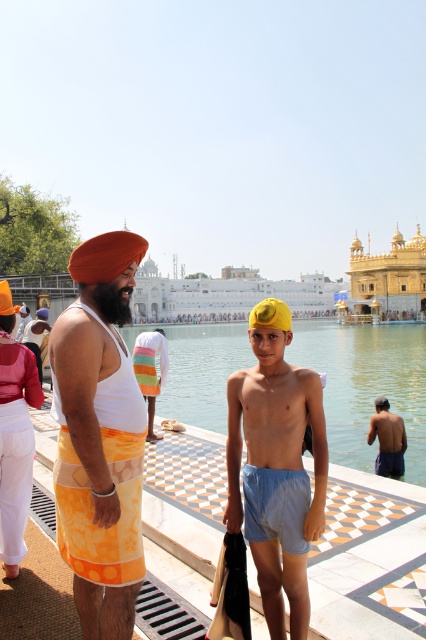
Question: Observing the image, what is the correct spatial positioning of light blue cotton shorts at lower right in reference to matte orange turban at upper left?

Choices:
 (A) above
 (B) below

Answer: (B)

Question: Can you confirm if matte orange turban at upper left is bigger than orange fabric turban at upper left?

Choices:
 (A) yes
 (B) no

Answer: (A)

Question: Which object is closer to the camera taking this photo?

Choices:
 (A) matte orange turban at center
 (B) yellow fabric headwear at center

Answer: (A)

Question: Which point is farther to the camera?

Choices:
 (A) yellow fabric headwear at center
 (B) light blue cotton shorts at lower right
 (C) orange fabric turban at upper left

Answer: (C)

Question: Is yellow fabric headwear at center bigger than light blue cotton shorts at lower right?

Choices:
 (A) no
 (B) yes

Answer: (B)

Question: Which object is closer to the camera taking this photo?

Choices:
 (A) light blue cotton shorts at lower right
 (B) matte orange turban at center

Answer: (B)